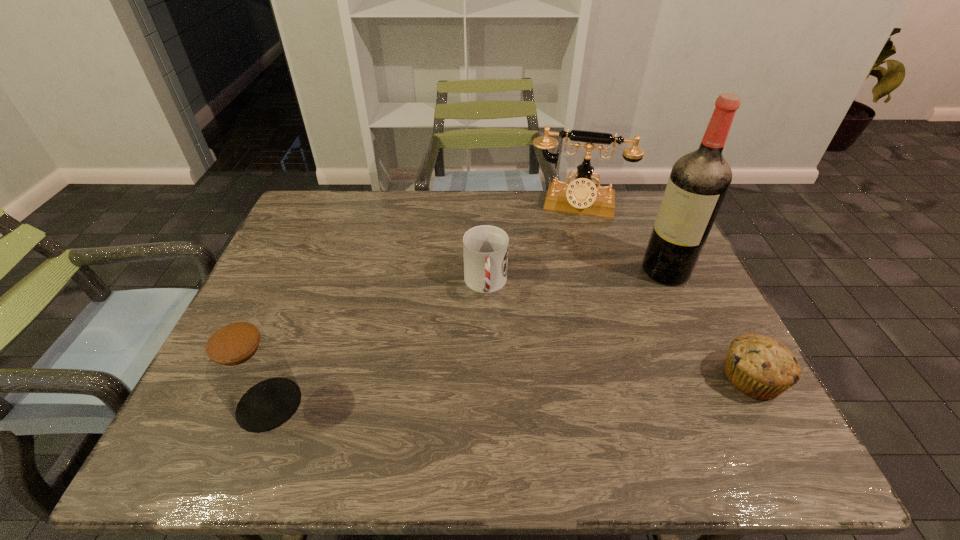
Where is `the leftmost object`? The width and height of the screenshot is (960, 540). the leftmost object is located at coordinates click(x=248, y=370).

Locate an element on the screen. Image resolution: width=960 pixels, height=540 pixels. jar is located at coordinates (248, 370).

The height and width of the screenshot is (540, 960). What are the coordinates of `muffin` in the screenshot? It's located at (761, 367).

I want to click on liquor, so click(698, 183).

Locate an element on the screen. This screenshot has height=540, width=960. the fourth object from right to left is located at coordinates (485, 247).

Locate an element on the screen. Image resolution: width=960 pixels, height=540 pixels. cup is located at coordinates (485, 247).

This screenshot has height=540, width=960. I want to click on telephone, so pyautogui.click(x=581, y=196).

You are a GUI agent. You are given a task and a screenshot of the screen. Output one action in this format:
    pyautogui.click(x=<x>, y=<y>)
    Task: Click on the farthest object
    The width and height of the screenshot is (960, 540).
    Given the screenshot: What is the action you would take?
    pyautogui.click(x=581, y=196)

In order to click on free spot located 0.210m on the back of the leftmost object in this screenshot , I will do `click(307, 307)`.

Where is `vacant space located on the back of the muffin`? vacant space located on the back of the muffin is located at coordinates (686, 254).